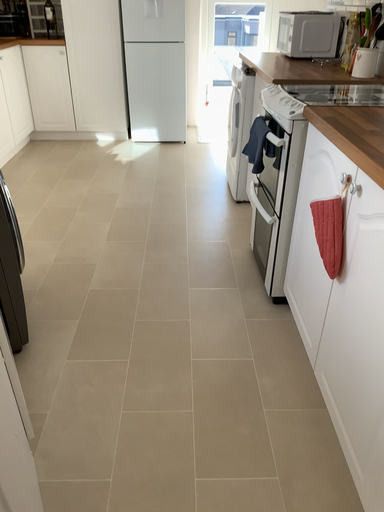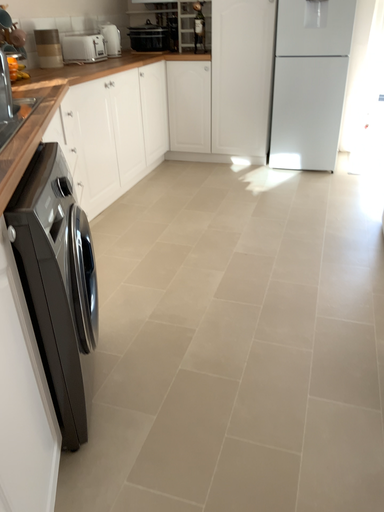
Question: Which way did the camera rotate in the video?

Choices:
 (A) rotated right
 (B) rotated left

Answer: (B)